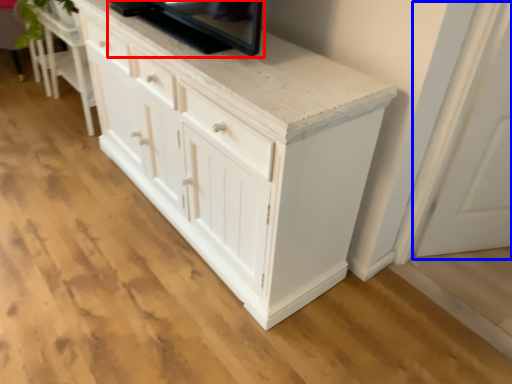
Question: Which object is closer to the camera taking this photo, appliance (highlighted by a red box) or glass door (highlighted by a blue box)?

Choices:
 (A) appliance
 (B) glass door

Answer: (A)